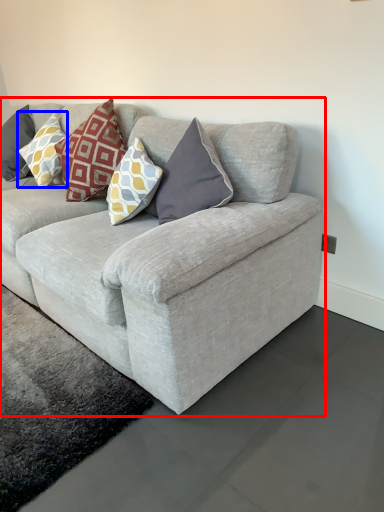
Question: Which point is further to the camera, studio couch (highlighted by a red box) or pillow (highlighted by a blue box)?

Choices:
 (A) studio couch
 (B) pillow

Answer: (B)